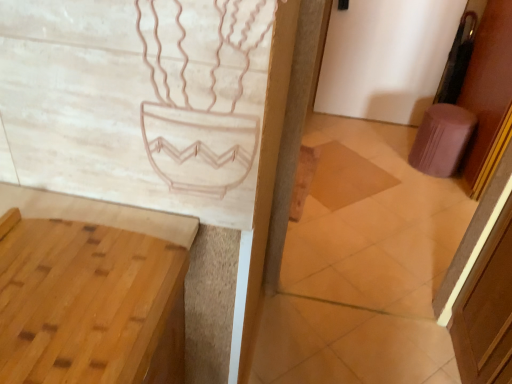
The height and width of the screenshot is (384, 512). In order to click on vacant region in front of pink fabric stool at right in this screenshot , I will do 433,191.